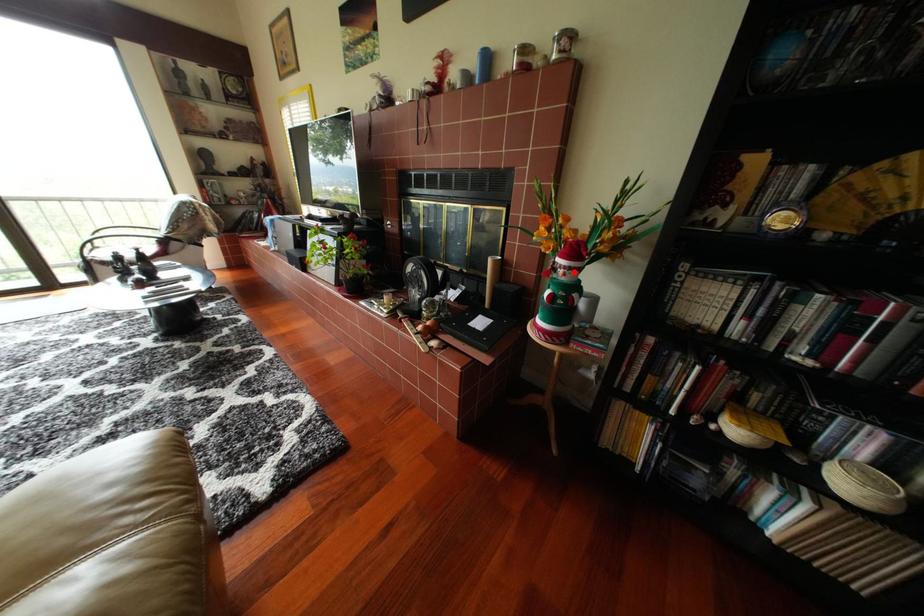
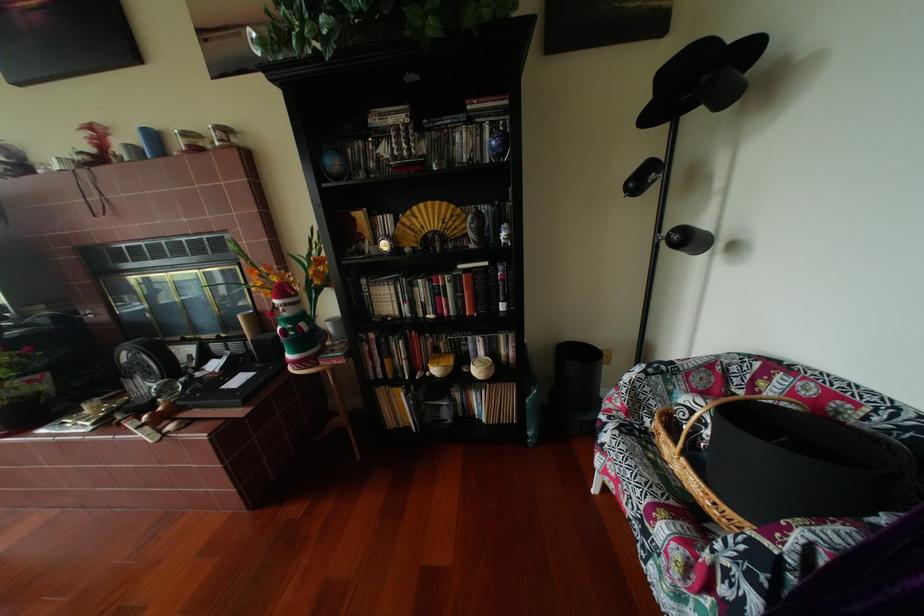
Locate, in the second image, the point that corresponds to the highlighted location in the first image.

(294, 310)